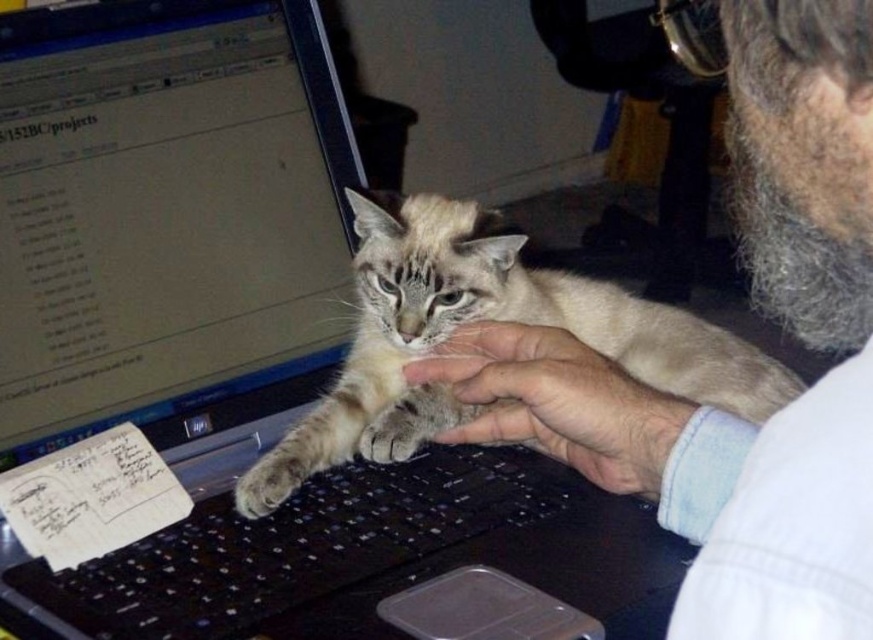
Is fuzzy beige cat at center above fur at center?

Yes, fuzzy beige cat at center is above fur at center.

Is point (526, 240) positioned in front of point (631, 486)?

No.

Where is `fuzzy beige cat at center`? fuzzy beige cat at center is located at coordinates (497, 320).

Is black plastic keyboard at center below fur at center?

Indeed, black plastic keyboard at center is positioned under fur at center.

Is point (461, 540) less distant than point (612, 429)?

No.

Locate an element on the screen. Image resolution: width=873 pixels, height=640 pixels. black plastic keyboard at center is located at coordinates (300, 545).

Is black plastic keyboard at center taller than fuzzy beige paw at keyboard?

Correct, black plastic keyboard at center is much taller as fuzzy beige paw at keyboard.

From the picture: Which of these two, black plastic keyboard at center or fuzzy beige paw at keyboard, stands shorter?

fuzzy beige paw at keyboard is shorter.

Between point (86, 576) and point (249, 513), which one is positioned behind?

Positioned behind is point (249, 513).

The image size is (873, 640). Identify the location of black plastic keyboard at center. (300, 545).